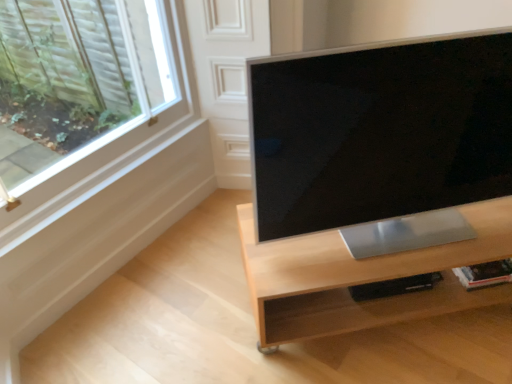
Locate an element on the screen. Image resolution: width=512 pixels, height=384 pixels. free region under silver metallic computer monitor at center (from a real-world perspective) is located at coordinates (401, 238).